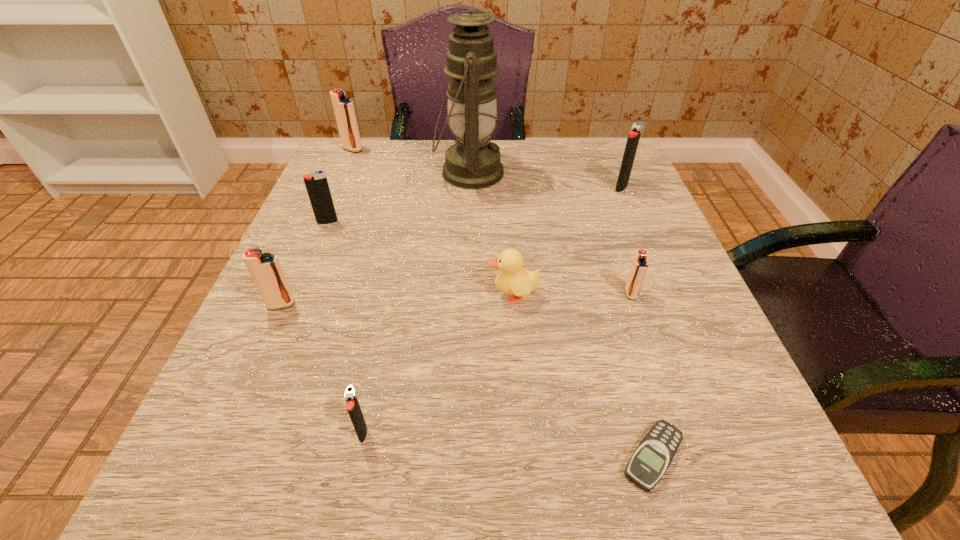
Find the location of `oil lamp`. oil lamp is located at coordinates (474, 162).

Where is `the biggest red igniter`? the biggest red igniter is located at coordinates (343, 107).

Where is `the farthest red igniter`? This screenshot has width=960, height=540. the farthest red igniter is located at coordinates (343, 107).

Image resolution: width=960 pixels, height=540 pixels. Identify the location of the biggest black igniter. (634, 135).

Where is `the second farthest igniter`? the second farthest igniter is located at coordinates (634, 135).

Where is `the leftmost black igniter`? Image resolution: width=960 pixels, height=540 pixels. the leftmost black igniter is located at coordinates (316, 183).

Identify the location of the third farthest igniter. The image size is (960, 540). (316, 183).

Where is `the second biggest red igniter`? the second biggest red igniter is located at coordinates (265, 269).

Where is `yellow duckling`? yellow duckling is located at coordinates (514, 280).

At what (x,y) coordinates should I click in order to perform the action: click on the fifth igniter from left to right. Please return your answer as a coordinate pair (x, y). This screenshot has height=540, width=960. Looking at the image, I should click on (639, 266).